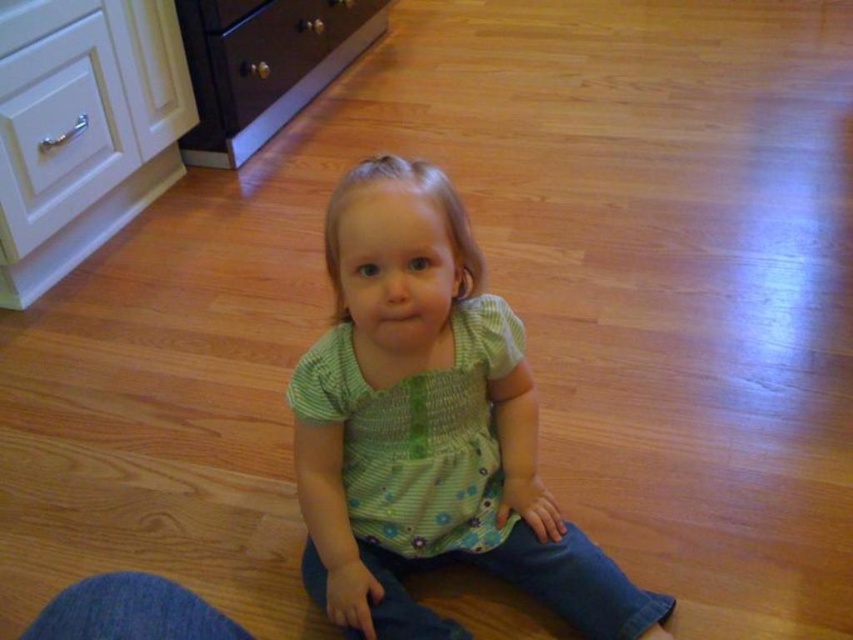
Question: Which object is closer to the camera taking this photo?

Choices:
 (A) green floral shirt at center
 (B) matte dark brown drawer at upper center

Answer: (A)

Question: Does white glossy dresser at upper left have a larger size compared to matte dark brown drawer at upper center?

Choices:
 (A) no
 (B) yes

Answer: (A)

Question: Can you confirm if white glossy dresser at upper left is positioned to the left of matte dark brown drawer at upper center?

Choices:
 (A) yes
 (B) no

Answer: (A)

Question: Among these objects, which one is nearest to the camera?

Choices:
 (A) green floral shirt at center
 (B) white glossy dresser at upper left
 (C) matte dark brown drawer at upper center

Answer: (A)

Question: Which of the following is the farthest from the observer?

Choices:
 (A) matte dark brown drawer at upper center
 (B) white glossy dresser at upper left

Answer: (A)

Question: Is white glossy dresser at upper left to the left of matte dark brown drawer at upper center from the viewer's perspective?

Choices:
 (A) yes
 (B) no

Answer: (A)